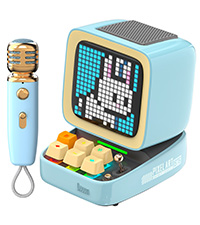
The width and height of the screenshot is (200, 225). What are the coordinates of `computer monitor` in the screenshot? It's located at (164, 77).